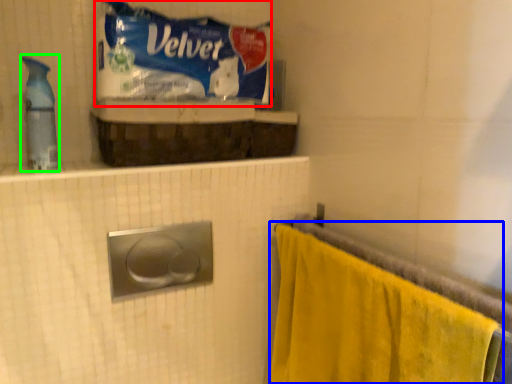
Question: Based on their relative distances, which object is farther from material (highlighted by a red box)? Choose from towel (highlighted by a blue box) and cleaning product (highlighted by a green box).

Choices:
 (A) towel
 (B) cleaning product

Answer: (A)